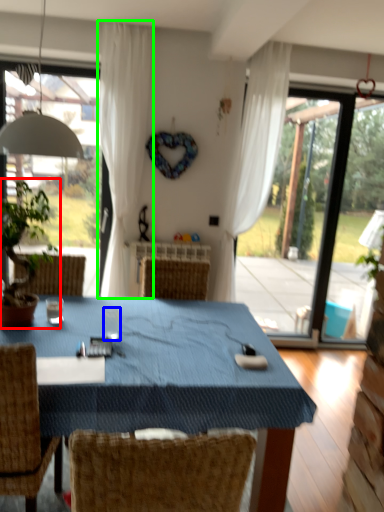
Question: Based on their relative distances, which object is farther from houseplant (highlighted by a red box)? Choose from coffee cup (highlighted by a blue box) and curtain (highlighted by a green box).

Choices:
 (A) coffee cup
 (B) curtain

Answer: (B)